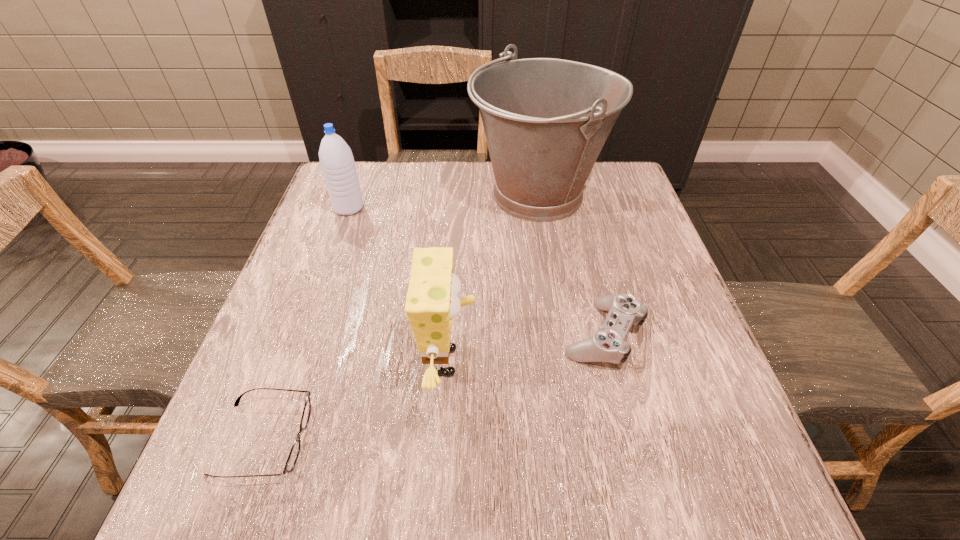
Find the location of a particular element. The height and width of the screenshot is (540, 960). the tallest object is located at coordinates (546, 120).

Find the location of a particular element. The height and width of the screenshot is (540, 960). water bottle is located at coordinates (337, 163).

I want to click on sponge, so click(432, 301).

I want to click on the second shortest object, so click(608, 344).

You are a GUI agent. You are given a task and a screenshot of the screen. Output one action in this format:
    pyautogui.click(x=<x>, y=<y>)
    Task: Click on the spectacles
    The width and height of the screenshot is (960, 540).
    Given the screenshot: What is the action you would take?
    pyautogui.click(x=294, y=452)

Find the location of a particular element. Image resolution: width=960 pixels, height=540 pixels. vacant area situated 0.090m on the left of the tallest object is located at coordinates (437, 196).

Image resolution: width=960 pixels, height=540 pixels. Identify the location of free space located 0.100m on the front of the water bottle. (337, 242).

This screenshot has width=960, height=540. Identify the location of free location located 0.260m on the front-facing side of the sponge. (613, 361).

This screenshot has height=540, width=960. What are the coordinates of `free space located on the left of the control` in the screenshot? It's located at (468, 334).

Find the location of `vacant space situated on the front-facing side of the spectacles`. vacant space situated on the front-facing side of the spectacles is located at coordinates (458, 439).